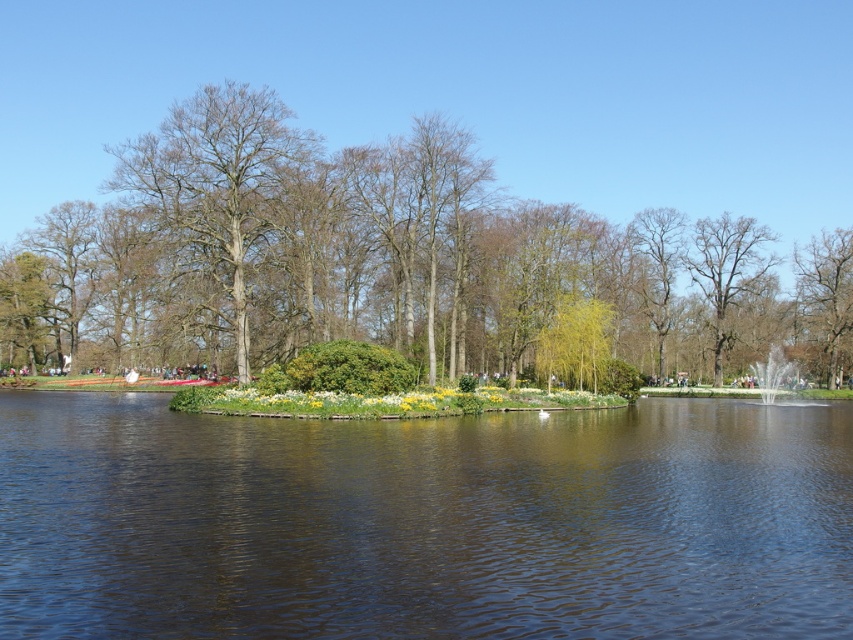
Does clear water at center have a smaller size compared to bare wood tree at center?

Yes, clear water at center is smaller than bare wood tree at center.

Image resolution: width=853 pixels, height=640 pixels. What do you see at coordinates (424, 522) in the screenshot?
I see `clear water at center` at bounding box center [424, 522].

You are a GUI agent. You are given a task and a screenshot of the screen. Output one action in this format:
    pyautogui.click(x=<x>, y=<y>)
    Task: Click on the clear water at center
    
    Given the screenshot: What is the action you would take?
    pyautogui.click(x=424, y=522)

Looking at this image, who is more distant from viewer, (177, 218) or (717, 310)?

The point (717, 310) is more distant.

Who is positioned more to the left, bare wood tree at center or smooth bark tree at center?

Positioned to the left is bare wood tree at center.

Is point (260, 154) positioned behind point (701, 282)?

No, it is in front of (701, 282).

Where is `bare wood tree at center`? bare wood tree at center is located at coordinates coord(213,196).

Find the location of `green leafy tree at center`. green leafy tree at center is located at coordinates (366, 260).

This screenshot has height=640, width=853. What do you see at coordinates (366, 260) in the screenshot?
I see `green leafy tree at center` at bounding box center [366, 260].

Where is `green leafy tree at center`? Image resolution: width=853 pixels, height=640 pixels. green leafy tree at center is located at coordinates (366, 260).